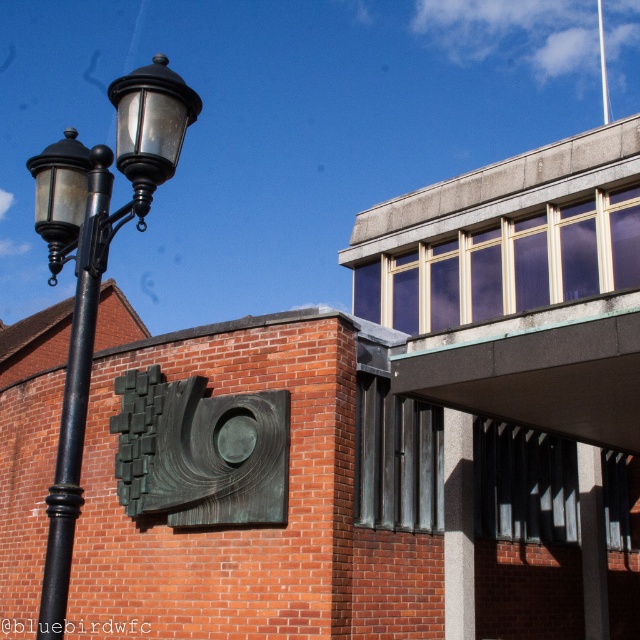
Question: Can you confirm if black metal streetlight at left is positioned to the left of black metal pole at left?

Choices:
 (A) no
 (B) yes

Answer: (B)

Question: Which of the following is the farthest from the observer?

Choices:
 (A) (108, 192)
 (B) (84, 200)

Answer: (B)

Question: Which of the following is the closest to the observer?

Choices:
 (A) (42, 611)
 (B) (80, 330)

Answer: (A)

Question: Observing the image, what is the correct spatial positioning of black metal streetlight at left in reference to black metal pole at left?

Choices:
 (A) above
 (B) below

Answer: (A)

Question: Is black metal streetlight at left positioned at the back of black metal pole at left?

Choices:
 (A) yes
 (B) no

Answer: (A)